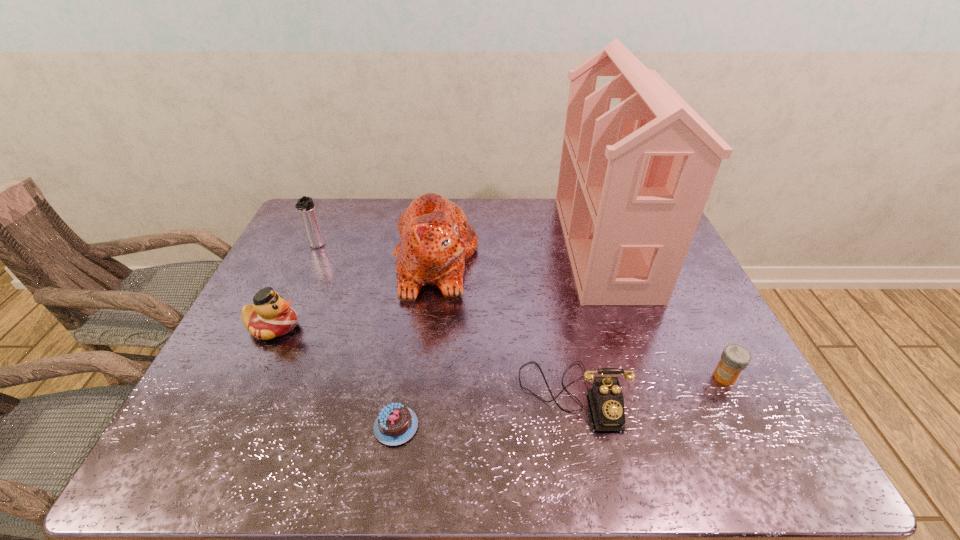
Find the location of `vacant area located 0.250m on the front-facing side of the tallest object`. vacant area located 0.250m on the front-facing side of the tallest object is located at coordinates (487, 246).

Where is `free space located 0.160m on the front-facing side of the tallest object`? free space located 0.160m on the front-facing side of the tallest object is located at coordinates (515, 246).

Find the location of a particular element. free region located 0.060m on the face of the cat is located at coordinates (497, 261).

Where is `vacant space positioned 0.090m on the handle side of the thermos bottle`? vacant space positioned 0.090m on the handle side of the thermos bottle is located at coordinates (304, 272).

Where is `blank space located on the face of the fourth shortest object`? blank space located on the face of the fourth shortest object is located at coordinates coord(441,327).

Locate an element on the screen. The width and height of the screenshot is (960, 540). free space located on the label side of the second shortest object is located at coordinates tap(583, 377).

Image resolution: width=960 pixels, height=540 pixels. I want to click on vacant region located 0.380m on the label side of the second shortest object, so click(x=553, y=377).

The image size is (960, 540). Find the location of `vacant space situated 0.380m on the label side of the second shortest object`. vacant space situated 0.380m on the label side of the second shortest object is located at coordinates (553, 377).

Identify the location of vacant region located 0.100m on the right of the shortest object. (465, 426).

What are the coordinates of `dollhouse positioned at the far edge` in the screenshot? It's located at (633, 182).